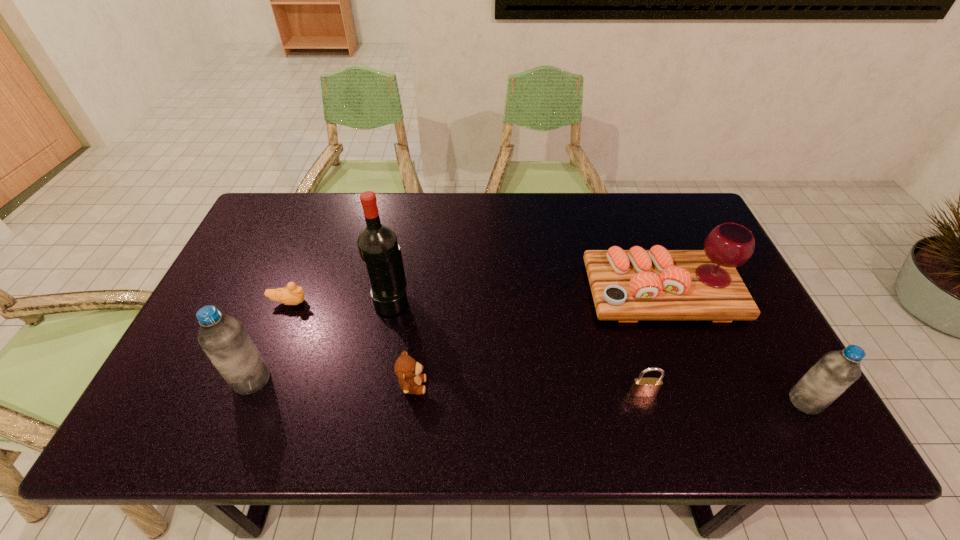
I want to click on vacant spot for a new water_bottle to ensure equal spacing, so click(523, 390).